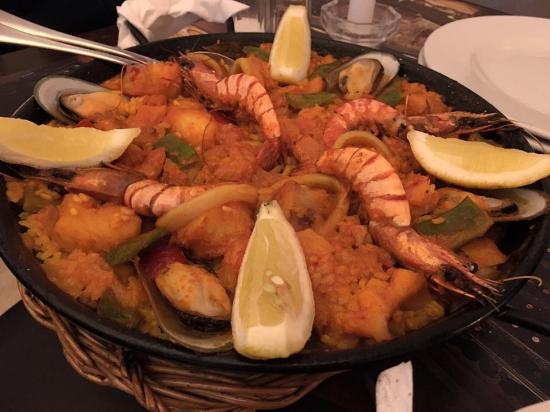
You are a GUI agent. You are given a task and a screenshot of the screen. Output one action in this format:
    pyautogui.click(x=<x>, y=<y>)
    Task: Click on the bowl
    
    Given the screenshot: What is the action you would take?
    pyautogui.click(x=108, y=329)